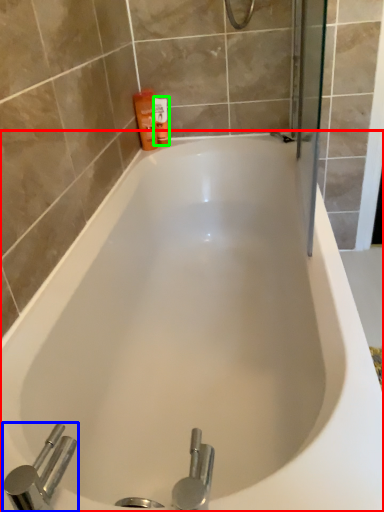
Question: Considering the real-world distances, which object is farthest from bathtub (highlighted by a red box)? tap (highlighted by a blue box) or toiletry (highlighted by a green box)?

Choices:
 (A) tap
 (B) toiletry

Answer: (B)